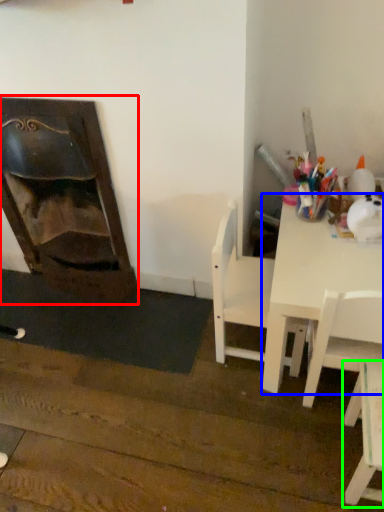
Question: Considering the real-world distances, which object is closest to fireplace (highlighted by a red box)? table (highlighted by a blue box) or chair (highlighted by a green box).

Choices:
 (A) table
 (B) chair

Answer: (A)